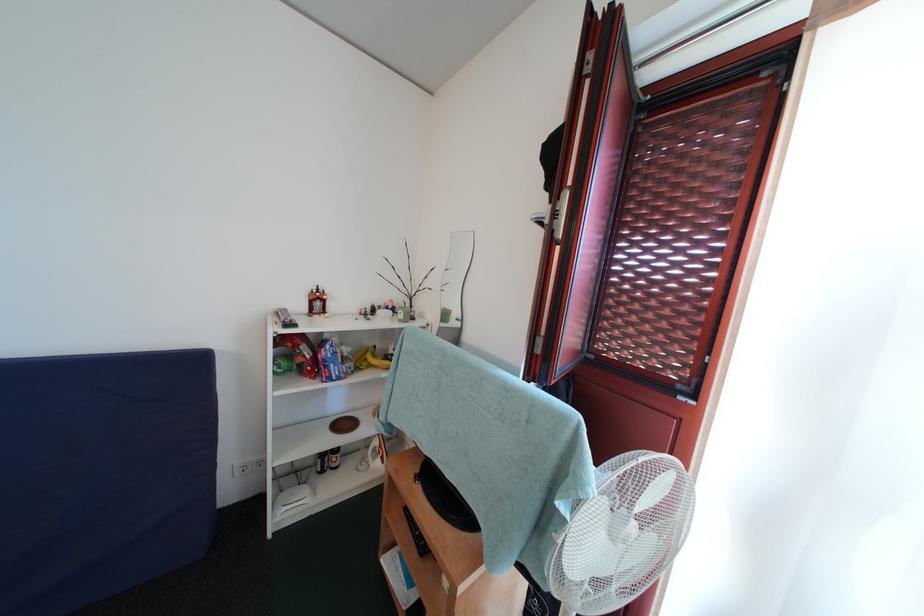
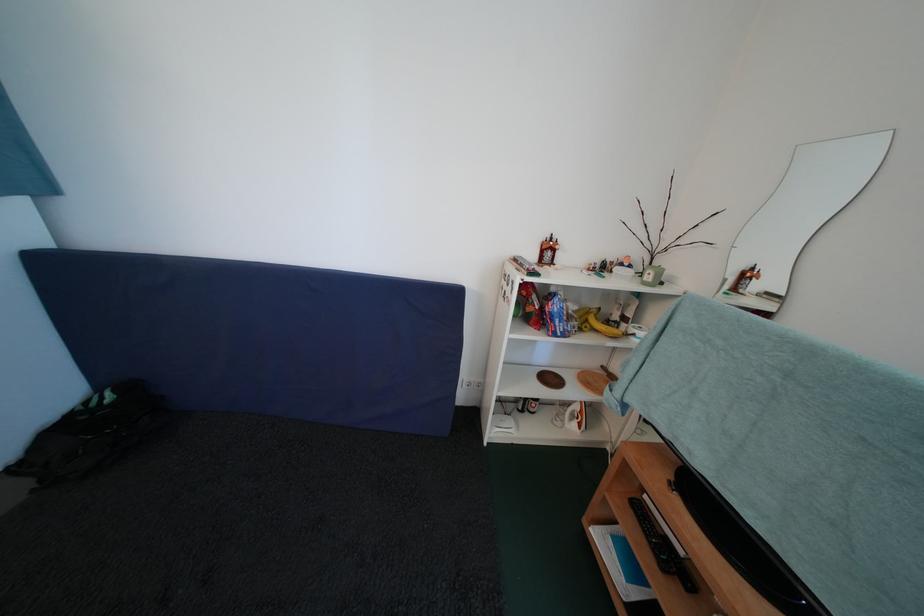
Locate, in the second image, the point that corresponds to (354,355) in the first image.

(579, 313)